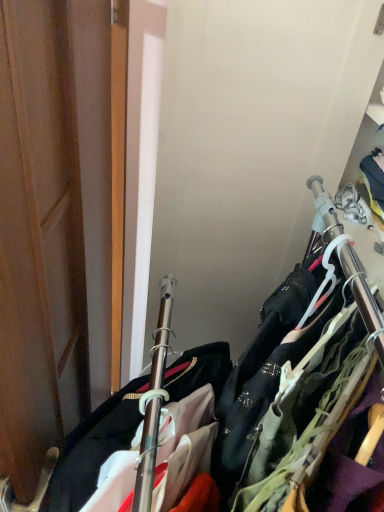
The width and height of the screenshot is (384, 512). What do you see at coordinates (58, 223) in the screenshot?
I see `wooden door at left` at bounding box center [58, 223].

Image resolution: width=384 pixels, height=512 pixels. I want to click on wooden door at left, so click(58, 223).

This screenshot has height=512, width=384. What are the coordinates of `metallic hangers at center` in the screenshot? It's located at (298, 364).

Describe the element at coordinates (298, 364) in the screenshot. I see `metallic hangers at center` at that location.

The width and height of the screenshot is (384, 512). I want to click on wooden door at left, so click(x=58, y=223).

Based on the photo, can you confirm if wooden door at left is positioned to the left of metallic hangers at center?

Correct, you'll find wooden door at left to the left of metallic hangers at center.

Is wooden door at left closer to the viewer compared to metallic hangers at center?

Yes, it is.

Which is nearer, [21,452] or [151,370]?

Point [21,452] is positioned closer to the camera compared to point [151,370].

From the image's perspective, is wooden door at left above or below metallic hangers at center?

Based on their image positions, wooden door at left is located above metallic hangers at center.

In the scene shown: From a real-world perspective, is wooden door at left on metallic hangers at center?

Correct, in the physical world, wooden door at left is higher than metallic hangers at center.

Between wooden door at left and metallic hangers at center, which one has larger width?

metallic hangers at center is wider.

Consider the image. Considering the sizes of objects wooden door at left and metallic hangers at center in the image provided, who is taller, wooden door at left or metallic hangers at center?

metallic hangers at center is taller.

Is wooden door at left smaller than metallic hangers at center?

Correct, wooden door at left occupies less space than metallic hangers at center.

Would you say wooden door at left contains metallic hangers at center?

No, metallic hangers at center is located outside of wooden door at left.

Is wooden door at left touching metallic hangers at center?

There is a gap between wooden door at left and metallic hangers at center.

Could you tell me if wooden door at left is facing metallic hangers at center?

No, wooden door at left is not turned towards metallic hangers at center.

Measure the distance between wooden door at left and metallic hangers at center.

A distance of 14.83 inches exists between wooden door at left and metallic hangers at center.

The image size is (384, 512). In the image, there is a wooden door at left. In order to click on closet below it (from a real-world perspective) in this screenshot , I will do `click(298, 364)`.

Is metallic hangers at center to the left or to the right of wooden door at left in the image?

metallic hangers at center is positioned on wooden door at left's right side.

Is metallic hangers at center in front of or behind wooden door at left in the image?

Visually, metallic hangers at center is located behind wooden door at left.

Does point (345, 286) appear closer or farther from the camera than point (71, 160)?

Point (345, 286) is closer to the camera than point (71, 160).

From the image's perspective, is metallic hangers at center above or below wooden door at left?

metallic hangers at center is situated lower than wooden door at left in the image.

From a real-world perspective, is metallic hangers at center located higher than wooden door at left?

Actually, metallic hangers at center is physically below wooden door at left in the real world.

Considering the sizes of metallic hangers at center and wooden door at left in the image, is metallic hangers at center wider or thinner than wooden door at left?

In the image, metallic hangers at center appears to be wider than wooden door at left.

Who is shorter, metallic hangers at center or wooden door at left?

Standing shorter between the two is wooden door at left.

Does metallic hangers at center have a smaller size compared to wooden door at left?

No, metallic hangers at center is not smaller than wooden door at left.

Is metallic hangers at center surrounding wooden door at left?

No, wooden door at left is not inside metallic hangers at center.

Is metallic hangers at center placed right next to wooden door at left?

No.

Looking at this image, is metallic hangers at center turned away from wooden door at left?

No, metallic hangers at center's orientation is not away from wooden door at left.

How different are the orientations of metallic hangers at center and wooden door at left in degrees?

1.4 degrees.

At what (x,y) coordinates should I click in order to perform the action: click on door above the metallic hangers at center (from a real-world perspective). Please return your answer as a coordinate pair (x, y). This screenshot has height=512, width=384. Looking at the image, I should click on point(58,223).

The height and width of the screenshot is (512, 384). I want to click on closet below the wooden door at left (from a real-world perspective), so click(298, 364).

This screenshot has width=384, height=512. Identify the location of door above the metallic hangers at center (from a real-world perspective). (58, 223).